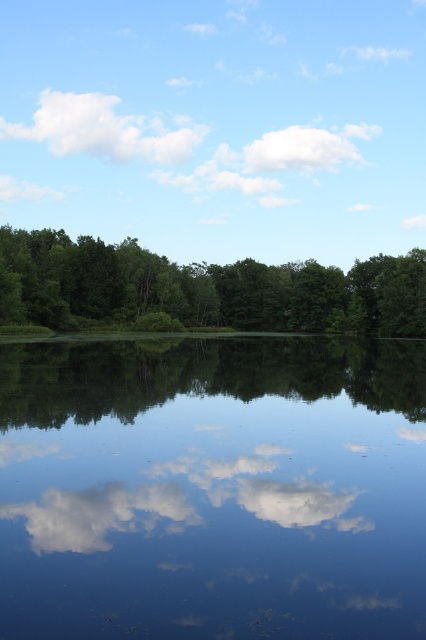
Does point (114, 120) come in front of point (344, 136)?

No, it is not.

Identify the location of white fluffy cloud at upper left. (103, 129).

You are a GUI agent. You are given a task and a screenshot of the screen. Output one action in this format:
    pyautogui.click(x=<x>, y=<y>)
    Task: Click on the white fluffy cloud at upper left
    
    Given the screenshot: What is the action you would take?
    pyautogui.click(x=103, y=129)

Identify the location of green leafy forest at center. This screenshot has height=640, width=426. (204, 288).

Is green leafy forest at center to the left of white fluffy cloud at upper left from the viewer's perspective?

Incorrect, green leafy forest at center is not on the left side of white fluffy cloud at upper left.

Between point (420, 332) and point (34, 131), which one is positioned behind?

Positioned behind is point (34, 131).

Find the location of `green leafy forest at center`. green leafy forest at center is located at coordinates (204, 288).

Does green leafy forest at center appear over white fluffy cloud at upper center?

Actually, green leafy forest at center is below white fluffy cloud at upper center.

Which is more to the right, green leafy forest at center or white fluffy cloud at upper center?

From the viewer's perspective, white fluffy cloud at upper center appears more on the right side.

Find the location of `green leafy forest at center`. green leafy forest at center is located at coordinates (204, 288).